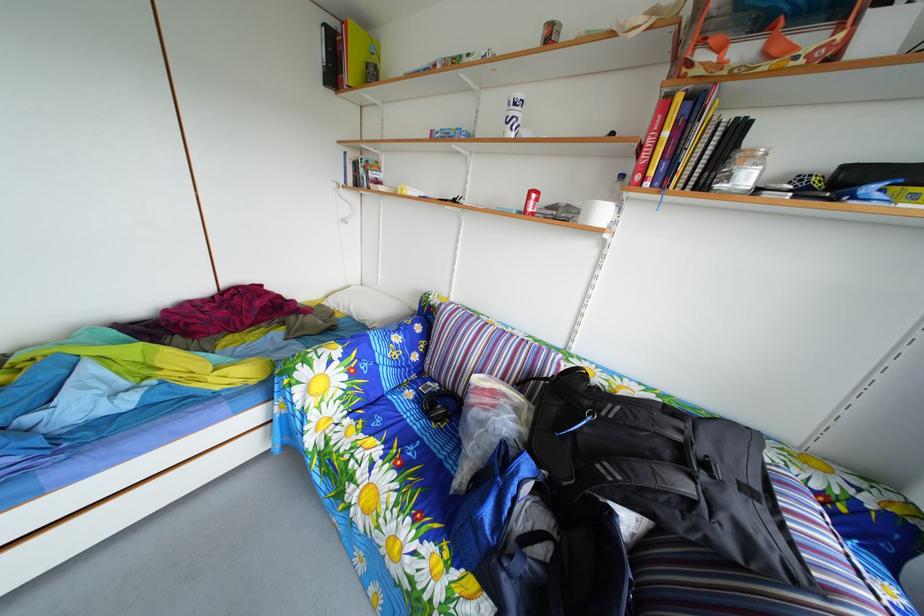
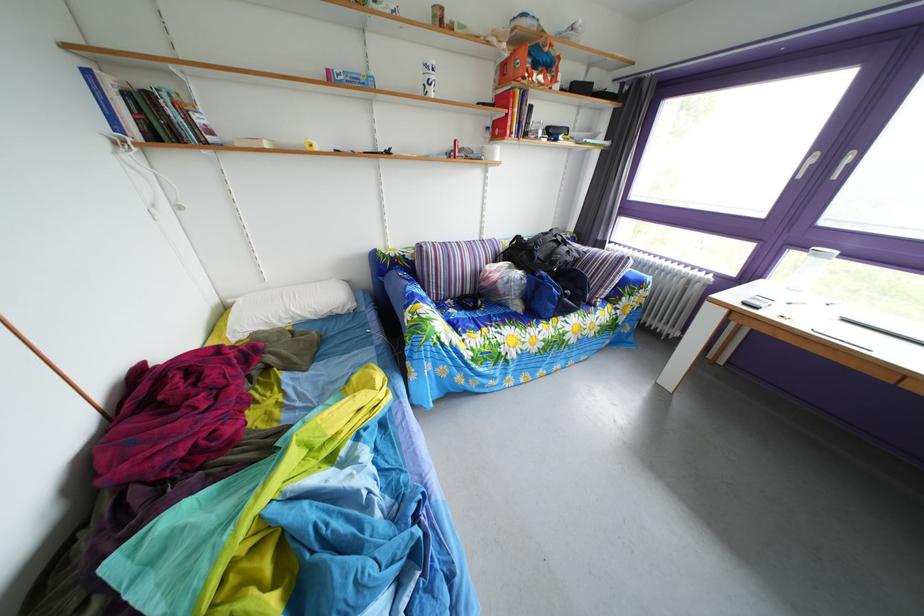
Where in the second image is the point corresponding to the point at 633,185 from the first image?

(499, 137)